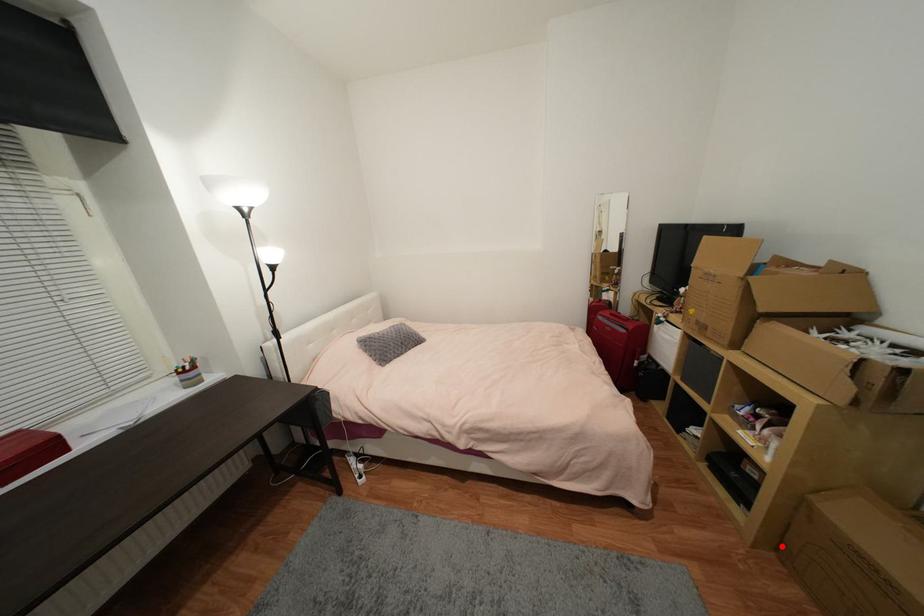
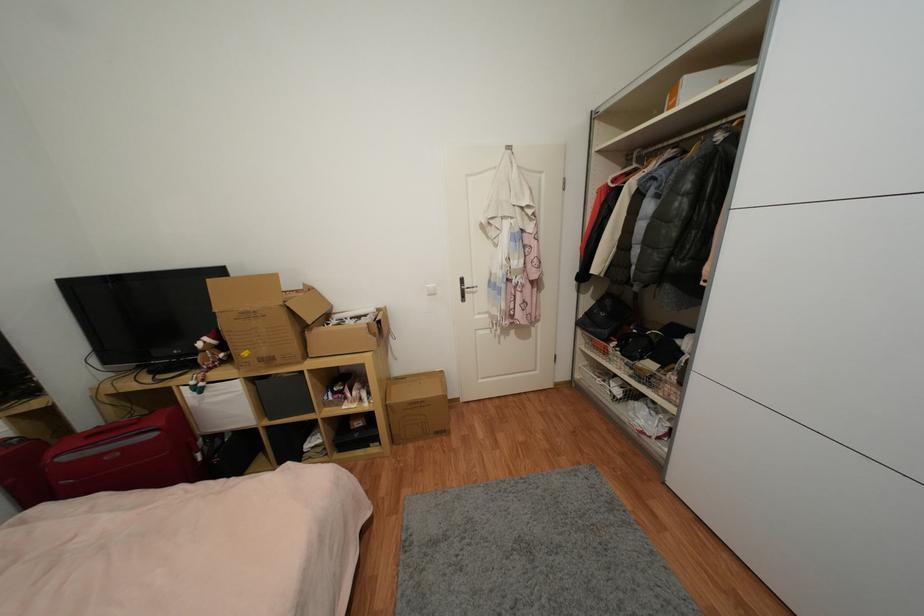
Find the pixel in the second image that matches the highlighted location in the first image.

(397, 440)